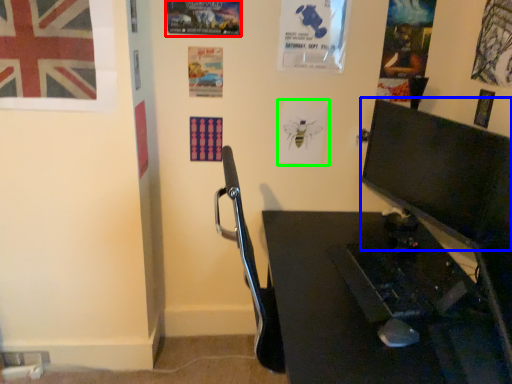
Question: Which object is positioned closest to poster page (highlighted by a red box)? Select from computer monitor (highlighted by a blue box) and poster page (highlighted by a green box).

Choices:
 (A) computer monitor
 (B) poster page

Answer: (B)